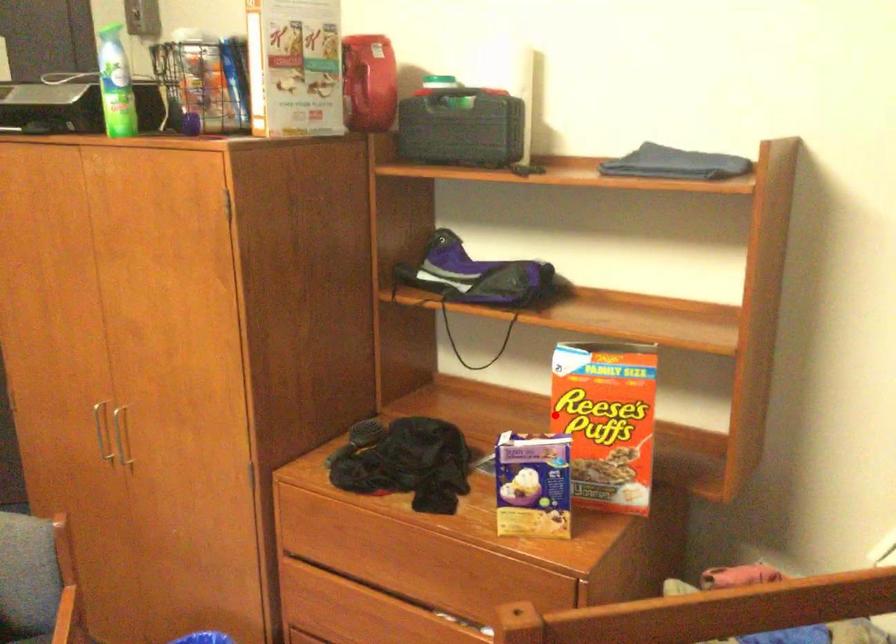
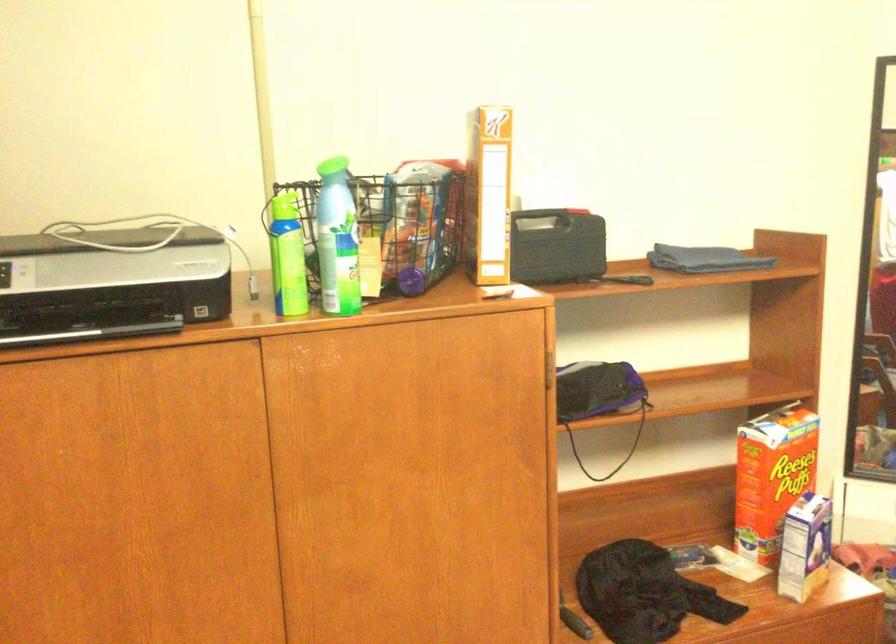
Locate, in the second image, the point that corresponds to the highlighted location in the first image.

(771, 477)